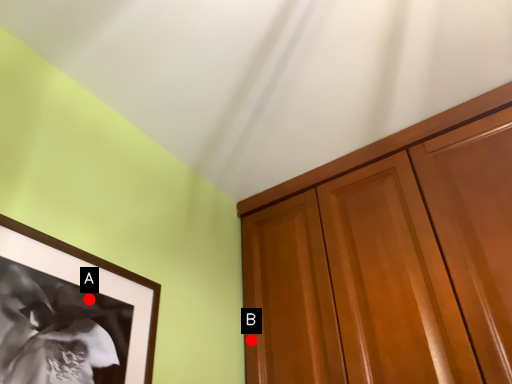
Question: Two points are circled on the image, labeled by A and B beside each circle. Which point is closer to the camera taking this photo?

Choices:
 (A) A is closer
 (B) B is closer

Answer: (A)